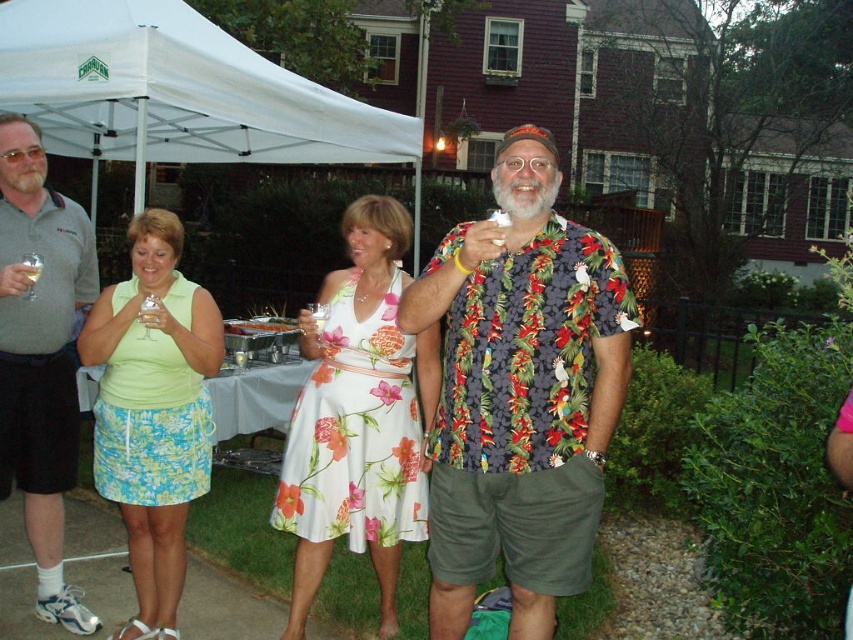
Question: Which point is closer to the camera taking this photo?

Choices:
 (A) pyautogui.click(x=32, y=284)
 (B) pyautogui.click(x=143, y=323)

Answer: (B)

Question: From the image, what is the correct spatial relationship of gray polo shirt at center in relation to clear glass wine at upper left?

Choices:
 (A) below
 (B) above

Answer: (A)

Question: Can you confirm if floral print shirt at center is smaller than lime green fabric skirt at left?

Choices:
 (A) no
 (B) yes

Answer: (A)

Question: Can you confirm if lime green fabric skirt at left is bigger than gray polo shirt at center?

Choices:
 (A) no
 (B) yes

Answer: (A)

Question: Which point is farther from the camera taking this photo?

Choices:
 (A) (312, 310)
 (B) (12, 364)

Answer: (A)

Question: Which object is farther from the camera taking this photo?

Choices:
 (A) lime green fabric skirt at left
 (B) clear glass wine at upper left
 (C) floral print shirt at center

Answer: (A)